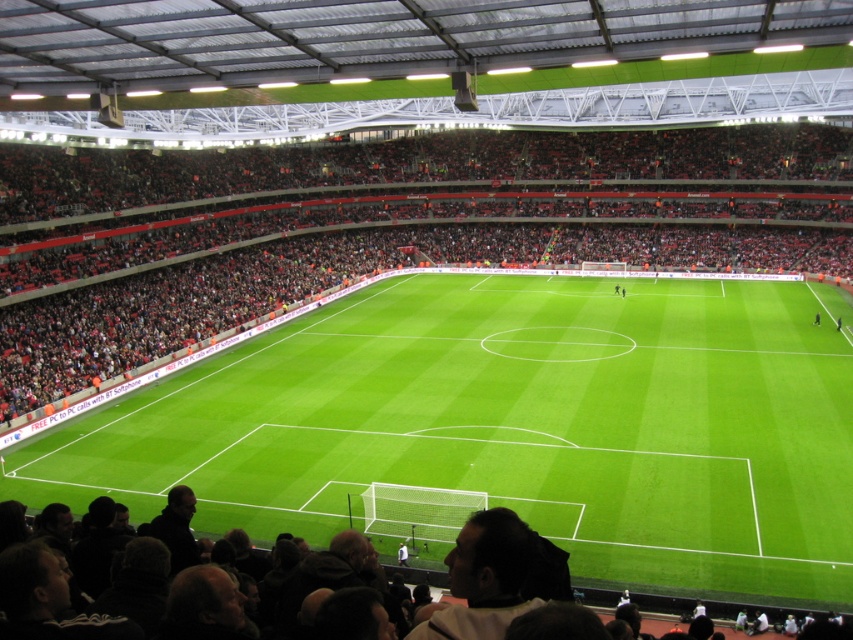
You are a drone operator trying to capture aerial footage of the football stadium. Your drone is currently hovering above the green grass football field at center. You need to fly it to the dark brown leather jacket at lower center. What is the minimum horizontal distance you need to cover to reach the jacket?

The minimum horizontal distance between the green grass football field at center and the dark brown leather jacket at lower center is 10.28 meters, so the drone needs to cover at least 10.28 meters horizontally to reach the jacket.

You are a photographer standing at the edge of the green grass football field at center. You want to take a photo of the red plastic seats at upper center. In which direction should you point your camera relative to the field?

The green grass football field at center is positioned on the left side of red plastic seats at upper center. Therefore, to photograph the red plastic seats at upper center, you should point your camera to the right of the field.